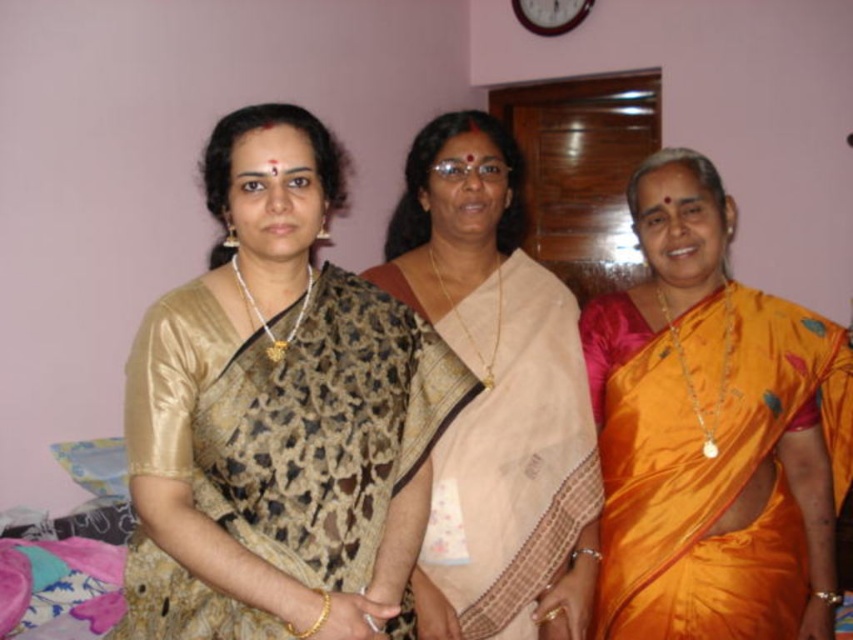
Question: Can you confirm if gold silk saree at left is thinner than beige silk saree at center?

Choices:
 (A) yes
 (B) no

Answer: (B)

Question: Which point is closer to the camera?

Choices:
 (A) (807, 387)
 (B) (281, 547)
 (C) (546, 428)

Answer: (B)

Question: Does gold silk saree at left have a smaller size compared to beige silk saree at center?

Choices:
 (A) no
 (B) yes

Answer: (B)

Question: Which point is closer to the camera?

Choices:
 (A) (252, 202)
 (B) (618, 420)
 (C) (532, 500)

Answer: (A)

Question: Which of the following is the farthest from the observer?

Choices:
 (A) (798, 371)
 (B) (570, 612)

Answer: (A)

Question: Is gold silk saree at left thinner than beige silk saree at center?

Choices:
 (A) yes
 (B) no

Answer: (B)